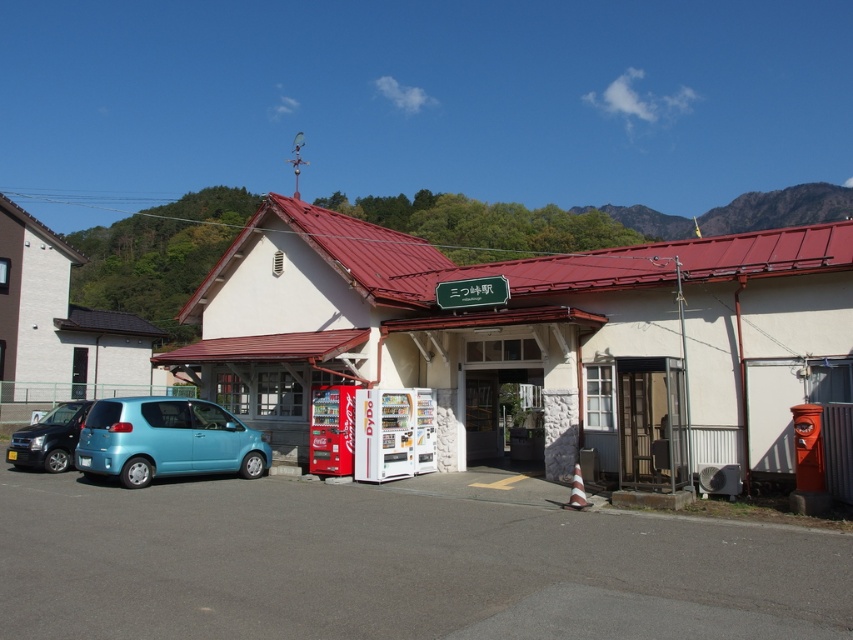
Does light blue matte hatchback at lower left appear on the right side of matte black suv at lower left?

Yes, light blue matte hatchback at lower left is to the right of matte black suv at lower left.

The image size is (853, 640). In order to click on light blue matte hatchback at lower left in this screenshot , I will do 166,440.

Based on the photo, is white matte building at center to the right of matte black suv at lower left from the viewer's perspective?

Correct, you'll find white matte building at center to the right of matte black suv at lower left.

Can you confirm if white matte building at center is thinner than matte black suv at lower left?

In fact, white matte building at center might be wider than matte black suv at lower left.

Does point (553, 474) come farther from viewer compared to point (27, 429)?

No, (553, 474) is in front of (27, 429).

Locate an element on the screen. This screenshot has height=640, width=853. white matte building at center is located at coordinates tap(534, 339).

Can you confirm if white matte building at center is smaller than light blue matte hatchback at lower left?

No, white matte building at center is not smaller than light blue matte hatchback at lower left.

Is white matte building at center to the right of light blue matte hatchback at lower left from the viewer's perspective?

Yes, white matte building at center is to the right of light blue matte hatchback at lower left.

Does point (329, 259) come closer to viewer compared to point (144, 417)?

No, (329, 259) is further to viewer.

This screenshot has height=640, width=853. In order to click on white matte building at center in this screenshot , I will do `click(534, 339)`.